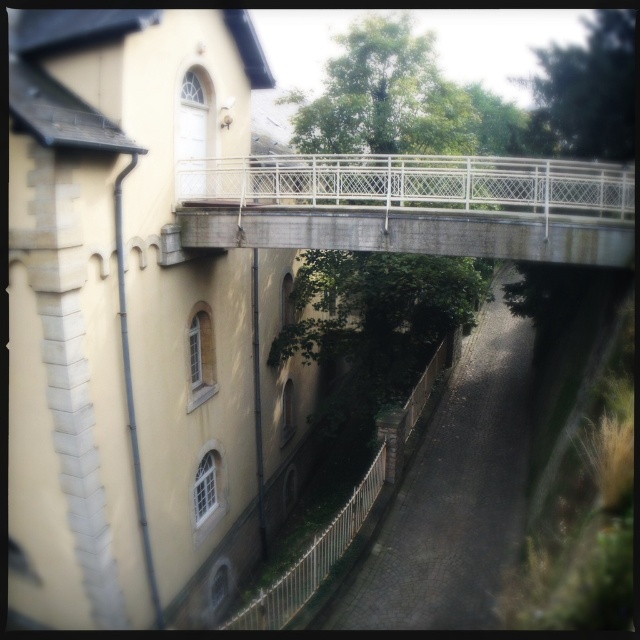
You are standing at the point marked by coordinates point (x=412, y=205) in the image. What structure are you currently on?

You are on the concrete rustic bridge at center located at point (x=412, y=205).